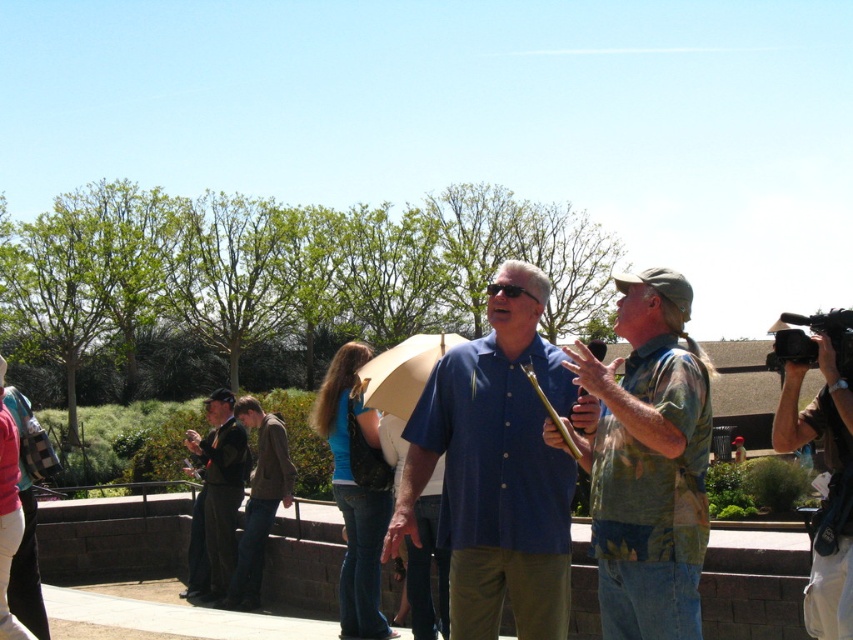
Question: Is camo-patterned shirt at center-right closer to the viewer compared to brown leather jacket at center?

Choices:
 (A) no
 (B) yes

Answer: (B)

Question: Observing the image, what is the correct spatial positioning of brown leather jacket at center in reference to beige fabric umbrella at center?

Choices:
 (A) left
 (B) right

Answer: (A)

Question: Based on their relative distances, which object is nearer to the blue shirt at center?

Choices:
 (A) dark blue uniform at center
 (B) camo-patterned shirt at center-right
 (C) beige fabric umbrella at center

Answer: (B)

Question: Which of the following is the farthest from the observer?

Choices:
 (A) (287, 474)
 (B) (216, 452)
 (C) (437, 442)
 (D) (834, 561)

Answer: (B)

Question: Can you confirm if blue shirt at center is positioned above dark blue uniform at center?

Choices:
 (A) no
 (B) yes

Answer: (B)

Question: Which point is farther to the camera?

Choices:
 (A) (631, 481)
 (B) (494, 353)
 (C) (846, 385)
 (D) (223, 464)

Answer: (D)